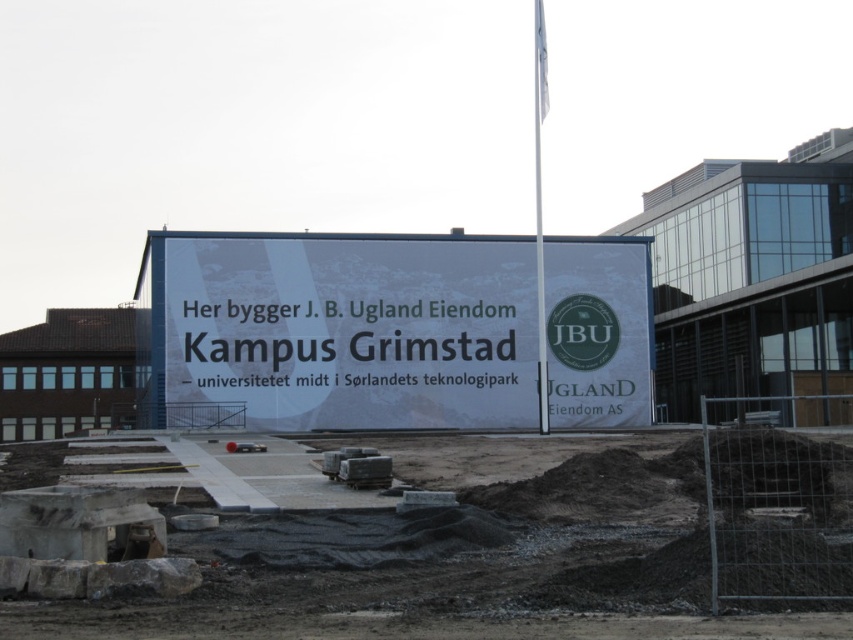
You are a delivery driver arriving at the construction site. You need to park your truck near the white paper billboard at center. However, there is a concrete paving at center nearby. Which object should you park closer to, and why?

You should park closer to the white paper billboard at center because the concrete paving at center is positioned on its right side, meaning the billboard is to the left of the paving. Since the billboard is your target, parking near it ensures you are at the correct location.

You are a construction worker standing at the edge of the construction site. You need to place a new safety sign between the concrete paving at center and the white paper billboard at center. Which object should you place the sign closer to if you want it to be more visible to people approaching from the front?

You should place the safety sign closer to the white paper billboard at center because the concrete paving at center is closer to the viewer. Objects closer to the viewer would block the view of those behind, so positioning the sign near the billboard ensures it remains visible to approaching individuals.